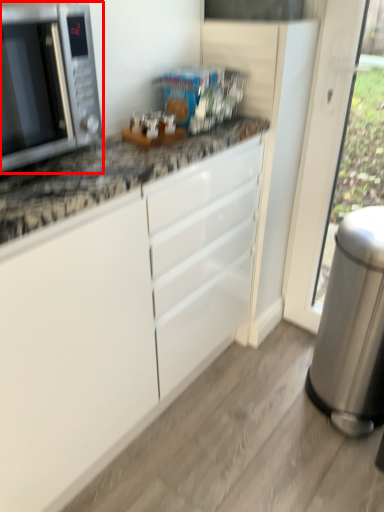
Question: In this image, where is microwave oven (annotated by the red box) located relative to appliance?

Choices:
 (A) right
 (B) left

Answer: (B)